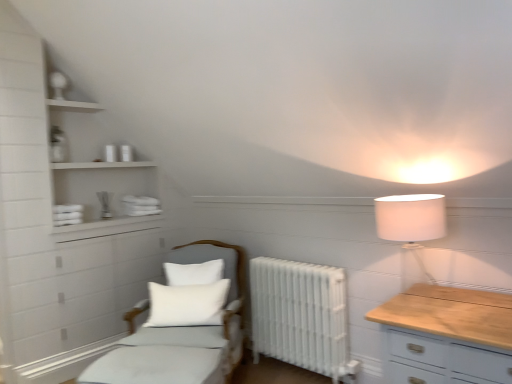
Question: Does white soft cushion at center have a larger size compared to white matte shelves at upper left?

Choices:
 (A) no
 (B) yes

Answer: (A)

Question: Could you tell me if white soft cushion at center is turned towards white matte shelves at upper left?

Choices:
 (A) no
 (B) yes

Answer: (A)

Question: Can you confirm if white soft cushion at center is smaller than white matte shelves at upper left?

Choices:
 (A) no
 (B) yes

Answer: (B)

Question: Is white soft cushion at center positioned behind white matte shelves at upper left?

Choices:
 (A) yes
 (B) no

Answer: (B)

Question: Is white soft cushion at center to the right of white matte shelves at upper left from the viewer's perspective?

Choices:
 (A) yes
 (B) no

Answer: (A)

Question: Does point (403, 259) appear closer or farther from the camera than point (148, 288)?

Choices:
 (A) farther
 (B) closer

Answer: (B)

Question: From a real-world perspective, is white fabric lampshade at upper right above or below white soft cushion at center?

Choices:
 (A) below
 (B) above

Answer: (B)

Question: Is white fabric lampshade at upper right bigger or smaller than white soft cushion at center?

Choices:
 (A) small
 (B) big

Answer: (B)

Question: In terms of height, does white fabric lampshade at upper right look taller or shorter compared to white soft cushion at center?

Choices:
 (A) short
 (B) tall

Answer: (B)

Question: Visually, is white fabric lampshade at upper right positioned to the left or to the right of white metallic radiator at center?

Choices:
 (A) right
 (B) left

Answer: (A)

Question: Is point (392, 216) positioned closer to the camera than point (269, 352)?

Choices:
 (A) farther
 (B) closer

Answer: (B)

Question: Is white fabric lampshade at upper right inside the boundaries of white metallic radiator at center, or outside?

Choices:
 (A) outside
 (B) inside

Answer: (A)

Question: From a real-world perspective, is white fabric lampshade at upper right positioned above or below white metallic radiator at center?

Choices:
 (A) below
 (B) above

Answer: (B)

Question: Which is correct: white fabric bed at lower left is inside white matte shelves at upper left, or outside of it?

Choices:
 (A) inside
 (B) outside

Answer: (B)

Question: From their relative heights in the image, would you say white fabric bed at lower left is taller or shorter than white matte shelves at upper left?

Choices:
 (A) tall
 (B) short

Answer: (B)